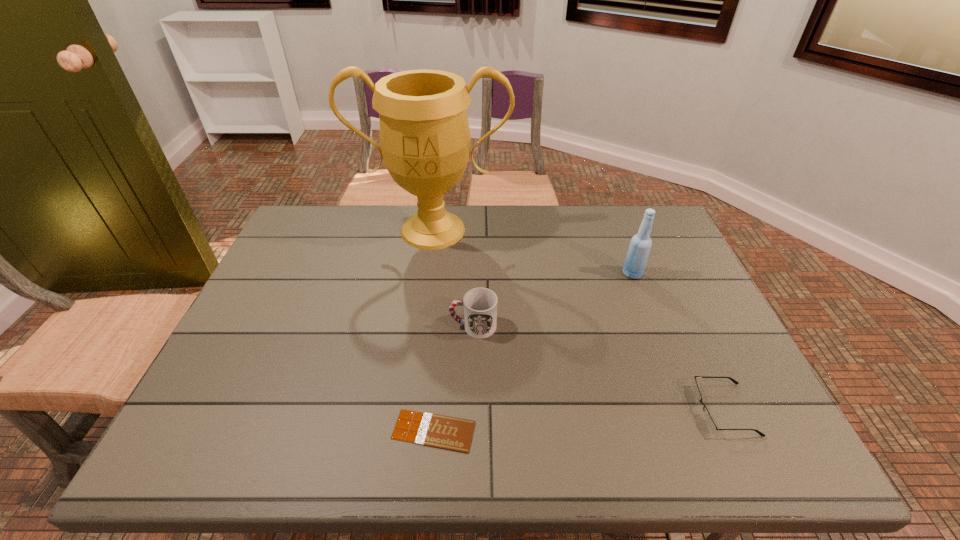
Where is `free location that satisfies the following two spatial constraints: 1. on the engravings side of the farthest object; 2. on the right side of the second tallest object`? The height and width of the screenshot is (540, 960). free location that satisfies the following two spatial constraints: 1. on the engravings side of the farthest object; 2. on the right side of the second tallest object is located at coordinates (427, 274).

Where is `vacant space that satisfies the following two spatial constraints: 1. on the handle side of the cup; 2. on the left side of the fourth nearest object`? This screenshot has height=540, width=960. vacant space that satisfies the following two spatial constraints: 1. on the handle side of the cup; 2. on the left side of the fourth nearest object is located at coordinates (474, 274).

Locate an element on the screen. The image size is (960, 540). free space in the image that satisfies the following two spatial constraints: 1. on the engravings side of the tallest object; 2. on the handle side of the third shortest object is located at coordinates (420, 326).

Identify the location of free spot that satisfies the following two spatial constraints: 1. on the handle side of the second tallest object; 2. on the right side of the cup. The image size is (960, 540). (474, 274).